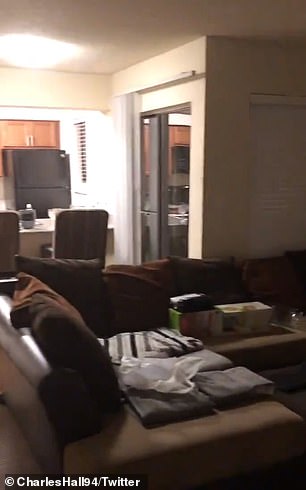
Identify the location of window. The height and width of the screenshot is (490, 306). (82, 154).